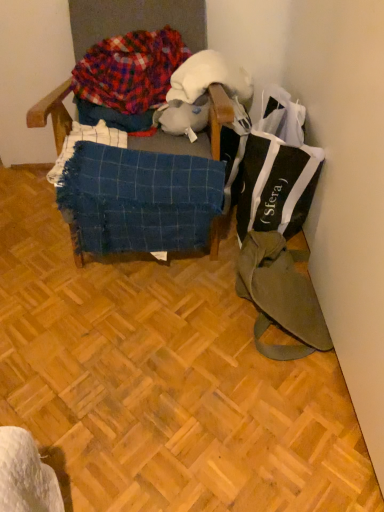
Locate an element on the screen. space that is in front of olive green canvas messenger bag at lower right is located at coordinates (266, 404).